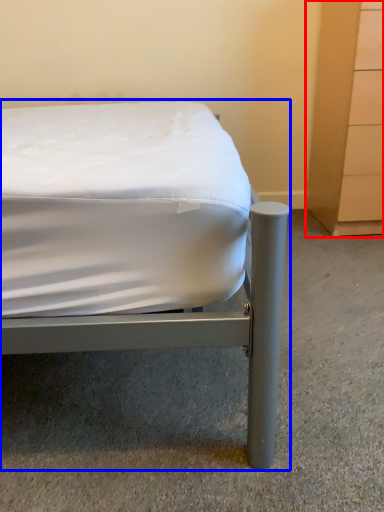
Question: Which object is further to the camera taking this photo, dresser (highlighted by a red box) or bed (highlighted by a blue box)?

Choices:
 (A) dresser
 (B) bed

Answer: (A)